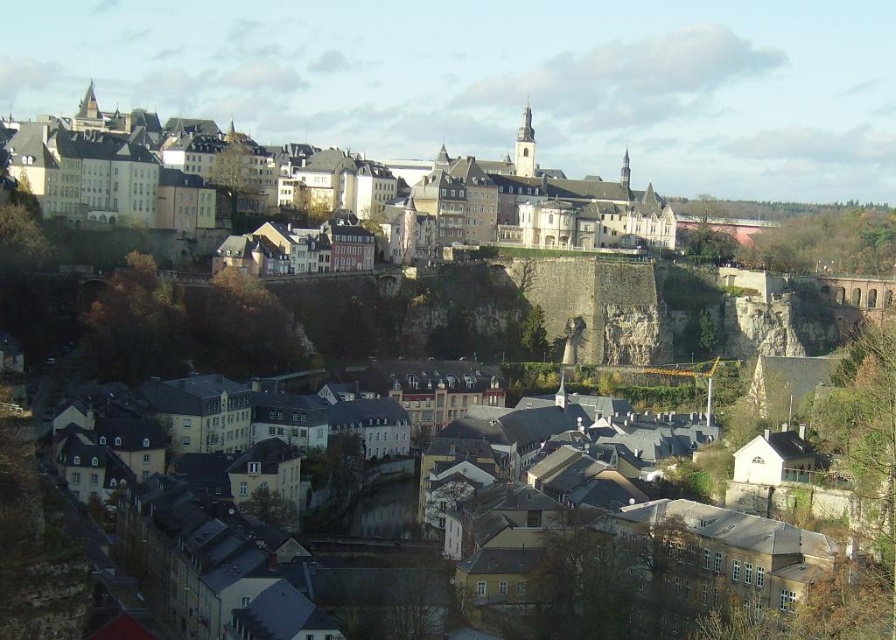
Question: Does matte stone castle at upper left have a larger size compared to yellow stone buildings at center?

Choices:
 (A) no
 (B) yes

Answer: (B)

Question: Can you confirm if matte stone castle at upper left is bigger than yellow stone buildings at center?

Choices:
 (A) no
 (B) yes

Answer: (B)

Question: Which point is farther from the camera taking this photo?

Choices:
 (A) (770, 557)
 (B) (141, 204)

Answer: (B)

Question: Can you confirm if matte stone castle at upper left is thinner than yellow stone buildings at center?

Choices:
 (A) yes
 (B) no

Answer: (B)

Question: Which point is closer to the camera?

Choices:
 (A) matte stone castle at upper left
 (B) yellow stone buildings at center

Answer: (B)